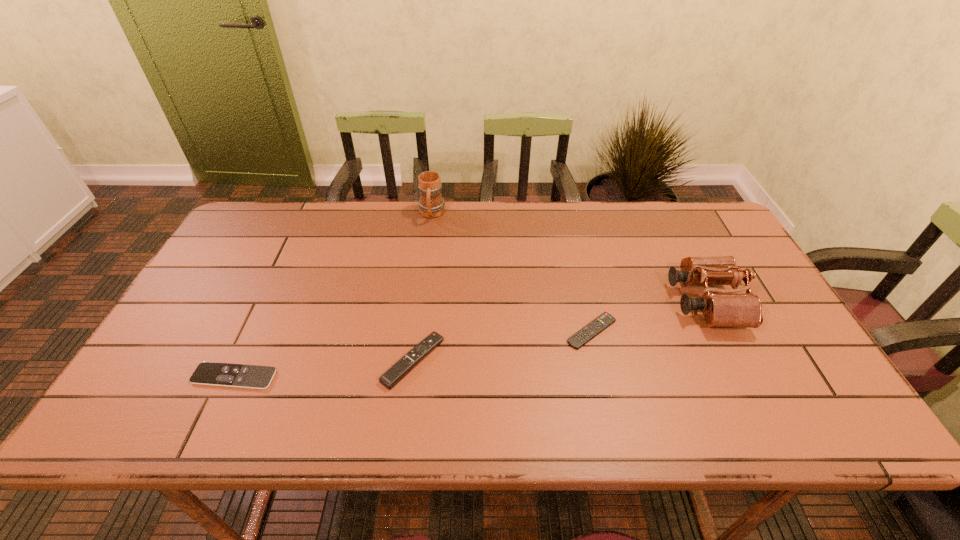
Identify the location of vacant region at the far left corner of the desktop. The height and width of the screenshot is (540, 960). (239, 227).

In the image, there is a desktop. Identify the location of blank space at the near left corner. This screenshot has height=540, width=960. (191, 413).

This screenshot has height=540, width=960. In the image, there is a desktop. Find the location of `vacant region at the far right corner`. vacant region at the far right corner is located at coordinates (662, 206).

You are a GUI agent. You are given a task and a screenshot of the screen. Output one action in this format:
    pyautogui.click(x=<x>, y=<y>)
    Task: Click on the vacant region between the leftmost object and the rightmost object
    The image size is (960, 540).
    Given the screenshot: What is the action you would take?
    pyautogui.click(x=470, y=339)

At what (x,y) coordinates should I click in order to perform the action: click on vacant region between the leftmost remote control and the second remote control from left to right. Please return your answer as a coordinate pair (x, y). Looking at the image, I should click on (324, 369).

The height and width of the screenshot is (540, 960). I want to click on empty space between the mug and the second object from right to left, so click(512, 273).

I want to click on free spot between the tallest remote control and the farthest object, so click(x=422, y=287).

Find the location of a particular element. Image resolution: width=960 pixels, height=540 pixels. free area in between the farthest object and the tallest remote control is located at coordinates (422, 287).

Find the location of `vacant space that's between the mug and the leftmost remote control`. vacant space that's between the mug and the leftmost remote control is located at coordinates (333, 295).

You are a GUI agent. You are given a task and a screenshot of the screen. Output one action in this format:
    pyautogui.click(x=<x>, y=<y>)
    Task: Click on the free space that is in between the leftmost object and the binoculars
    This screenshot has width=960, height=540.
    Given the screenshot: What is the action you would take?
    pyautogui.click(x=470, y=339)